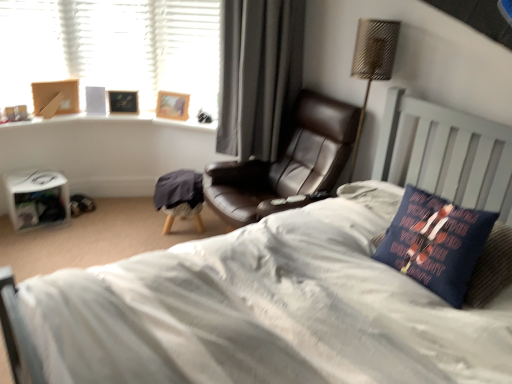
Question: Is dark blue fabric pillow at right spatially inside wooden picture frame at upper left, marked as the first picture frame in a right-to-left arrangement, or outside of it?

Choices:
 (A) outside
 (B) inside

Answer: (A)

Question: From a real-world perspective, relative to wooden picture frame at upper left, the second picture frame in the left-to-right sequence, is dark blue fabric pillow at right vertically above or below?

Choices:
 (A) above
 (B) below

Answer: (B)

Question: Estimate the real-world distances between objects in this image. Which object is closer to the metallic woven table lamp at upper right?

Choices:
 (A) black leather chair at center
 (B) white matte book at lower left
 (C) wooden picture frame at upper left, acting as the second picture frame starting from the right
 (D) leather at center
 (E) dark blue fabric pillow at right

Answer: (D)

Question: Based on their relative distances, which object is farther from the white matte book at lower left?

Choices:
 (A) metallic woven table lamp at upper right
 (B) black leather chair at center
 (C) dark blue fabric pillow at right
 (D) wooden picture frame at upper left, the 1th picture frame when ordered from left to right
 (E) wooden picture frame at upper left, marked as the first picture frame in a right-to-left arrangement

Answer: (C)